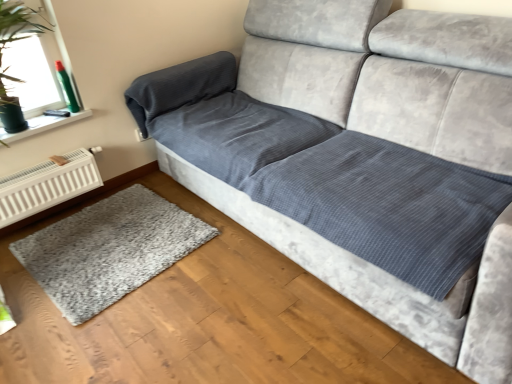
The image size is (512, 384). I want to click on free space in front of gray shaggy rug at lower left, so click(116, 332).